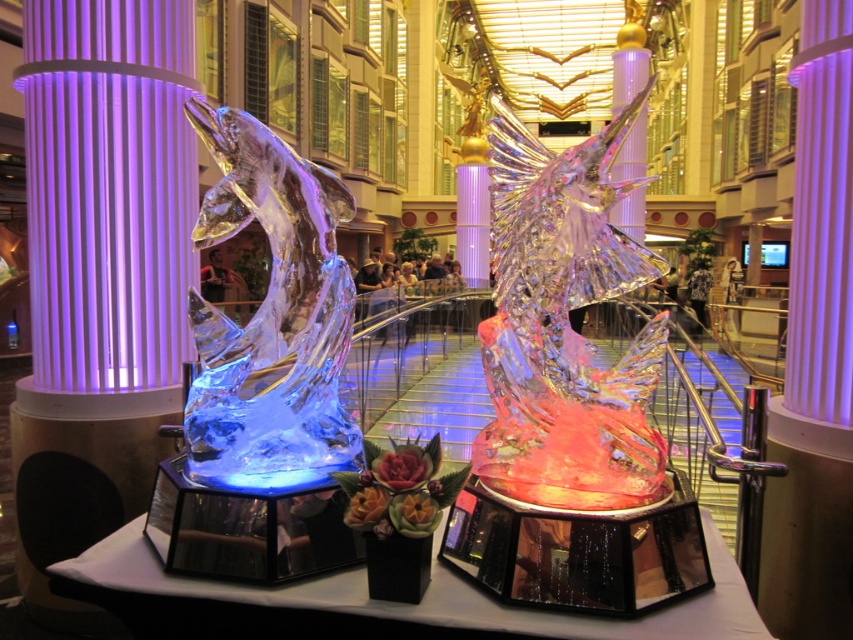
Question: Which of the following is the closest to the observer?

Choices:
 (A) (329, 177)
 (B) (776, 509)
 (C) (120, 568)

Answer: (C)

Question: Which of the following is the farthest from the observer?

Choices:
 (A) transparent ice fish at left
 (B) metallic column at center

Answer: (B)

Question: Considering the relative positions of transparent ice fish at left and transparent glass table at center in the image provided, where is transparent ice fish at left located with respect to transparent glass table at center?

Choices:
 (A) above
 (B) below

Answer: (A)

Question: Is purple translucent pillar at left positioned at the back of metallic column at center?

Choices:
 (A) no
 (B) yes

Answer: (B)

Question: Which point is farther from the camera taking this photo?

Choices:
 (A) (345, 212)
 (B) (833, 429)
 (C) (55, 336)

Answer: (C)

Question: Can you confirm if metallic column at center is positioned to the right of transparent glass table at center?

Choices:
 (A) yes
 (B) no

Answer: (A)